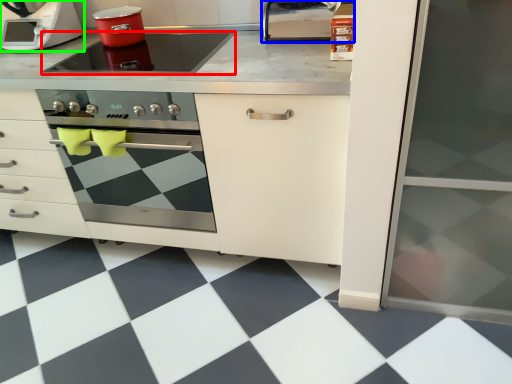
Question: Based on their relative distances, which object is nearer to kitchen appliance (highlighted by a red box)? Choose from appliance (highlighted by a blue box) and home appliance (highlighted by a green box).

Choices:
 (A) appliance
 (B) home appliance

Answer: (B)